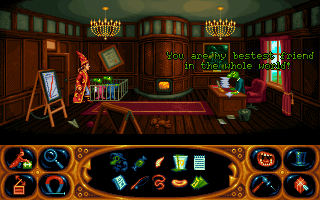
Where is `coat`? The width and height of the screenshot is (320, 200). coat is located at coordinates (82, 77).